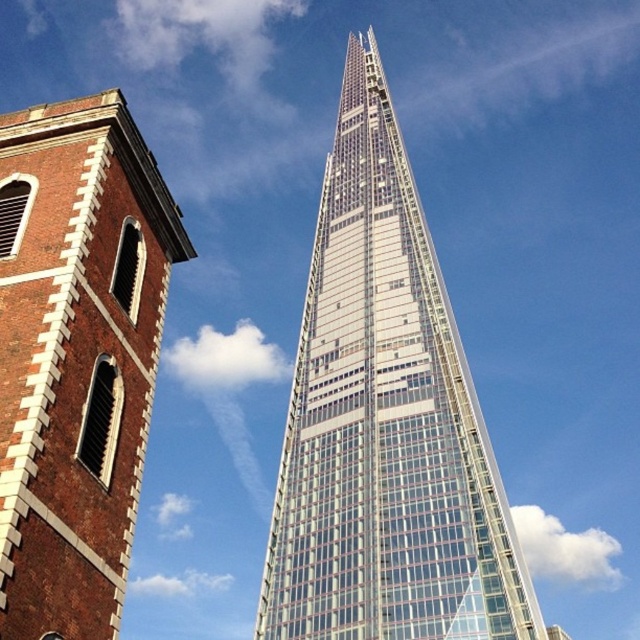
You are an architect evaluating the feasibility of installing a large billboard between the transparent glass tower at center and the brick tower at left. Given that the billboard requires a minimum of 20 meters of space between the two structures, can you determine if the available space is sufficient?

The transparent glass tower at center is bigger than brick tower at left, but the description does not provide specific spatial measurements between them. Therefore, it is impossible to confirm if the required 20 meters of space is available between the transparent glass tower at center and the brick tower at left.

You are a drone operator tasked with flying a drone between the transparent glass tower at center and the brick tower at left. Given that the drone has a maximum flight altitude of 100 meters, can it safely fly above both structures without hitting either?

The transparent glass tower at center is taller than the brick tower at left. Since the drone can fly up to 100 meters, it needs to know the exact heights to ensure safety. However, the provided information only states that the transparent glass tower at center is taller, not the specific heights. Without knowing the exact height of the transparent glass tower at center, it is impossible to determine if the drone can safely fly above both structures.

You are an architect planning to install a solar panel array on the rooftops of both the brick tower at left and the transparent glass tower at center. Considering their positions relative to each other, which tower would likely receive more direct sunlight throughout the day?

The transparent glass tower at center would likely receive more direct sunlight because it is positioned in front of the brick tower at left, meaning it is not obstructed by the brick tower and can capture sunlight more effectively throughout the day.